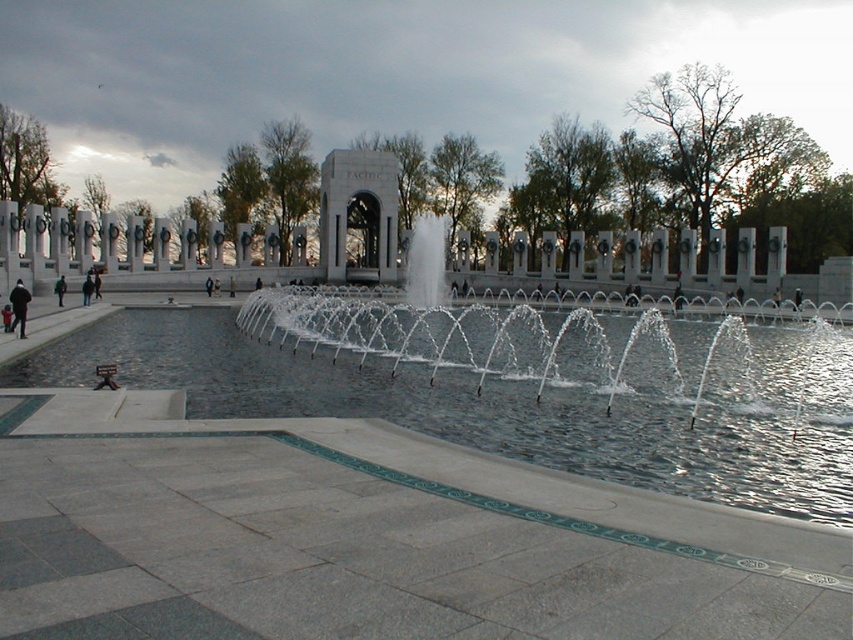
Question: Which is farther from the clear water at center?

Choices:
 (A) dark gray jacket at left
 (B) clear glass pool at center

Answer: (A)

Question: Is clear glass pool at center above dark gray jacket at left?

Choices:
 (A) no
 (B) yes

Answer: (A)

Question: Which point is closer to the camera?

Choices:
 (A) clear water at center
 (B) clear glass pool at center
 (C) dark gray jacket at left

Answer: (B)

Question: Does clear glass pool at center have a larger size compared to clear water at center?

Choices:
 (A) no
 (B) yes

Answer: (A)

Question: Can you confirm if clear glass pool at center is positioned to the left of clear water at center?

Choices:
 (A) yes
 (B) no

Answer: (A)

Question: Which of the following is the closest to the observer?

Choices:
 (A) (677, 307)
 (B) (22, 310)

Answer: (B)